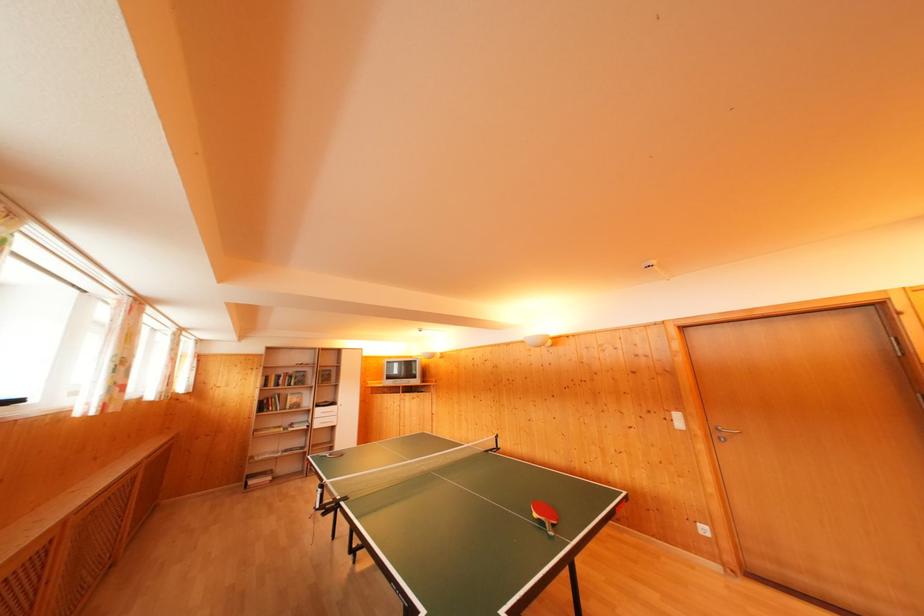
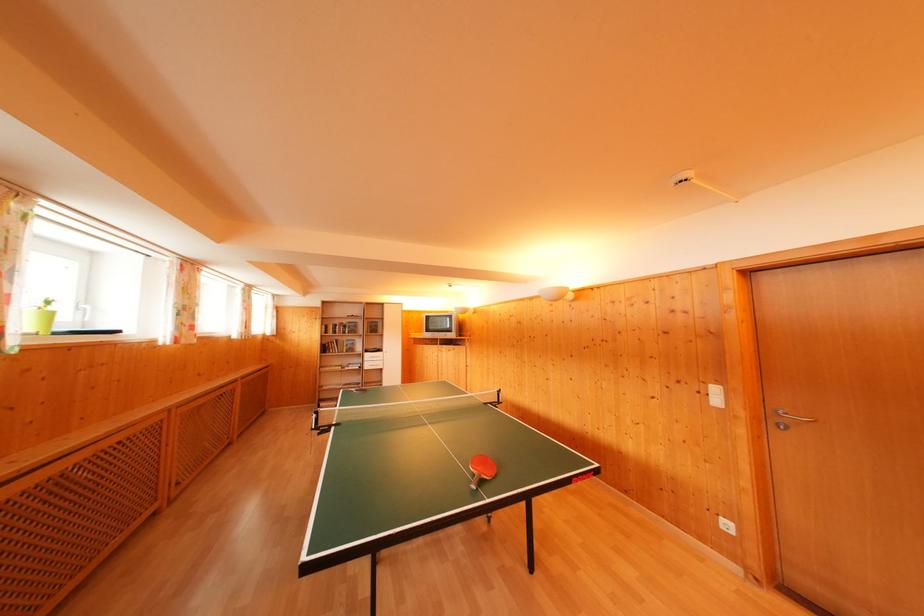
Where in the second image is the point corresponding to point 322,416 from the first image?

(371, 360)